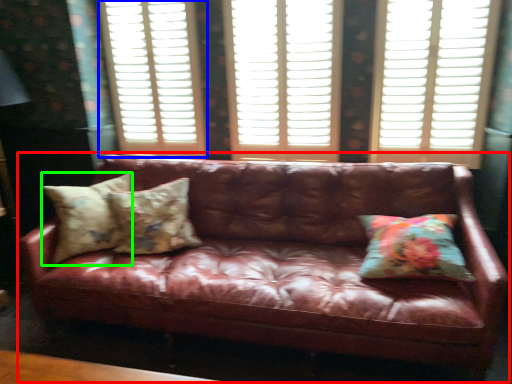
Question: Considering the real-world distances, which object is farthest from studio couch (highlighted by a red box)? window frame (highlighted by a blue box) or pillow (highlighted by a green box)?

Choices:
 (A) window frame
 (B) pillow

Answer: (A)